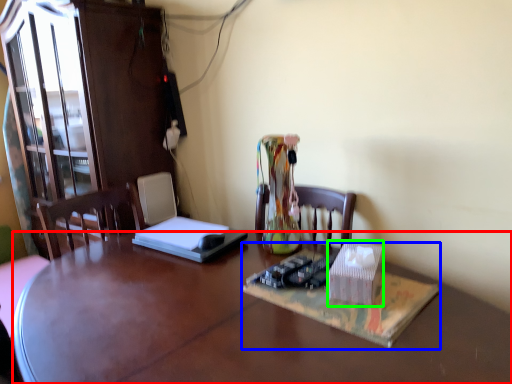
Question: Based on their relative distances, which object is farther from desk (highlighted by a red box)? Choose from book (highlighted by a blue box) and cardboard box (highlighted by a green box).

Choices:
 (A) book
 (B) cardboard box

Answer: (B)